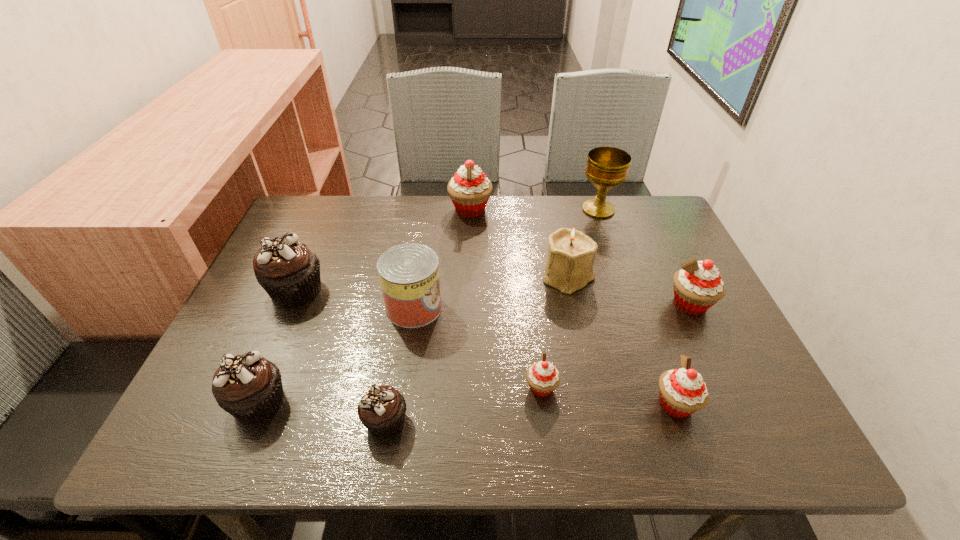
The image size is (960, 540). What are the coordinates of `cupcake identified as the fourth closest to the can` in the screenshot? It's located at (543, 377).

Point out which pink cupcake is positioned as the second nearest to the chalice. Please provide its 2D coordinates. Your answer should be formatted as a tuple, i.e. [(x, y)], where the tuple contains the x and y coordinates of a point satisfying the conditions above.

[(697, 286)]

Select which pink cupcake is the second closest to the can. Please provide its 2D coordinates. Your answer should be formatted as a tuple, i.e. [(x, y)], where the tuple contains the x and y coordinates of a point satisfying the conditions above.

[(469, 189)]

At what (x,y) coordinates should I click in order to perform the action: click on the closest brown cupcake to the chalice. Please return your answer as a coordinate pair (x, y). Looking at the image, I should click on (287, 270).

Identify which brown cupcake is the closest to the second smallest pink cupcake. Please provide its 2D coordinates. Your answer should be formatted as a tuple, i.e. [(x, y)], where the tuple contains the x and y coordinates of a point satisfying the conditions above.

[(382, 409)]